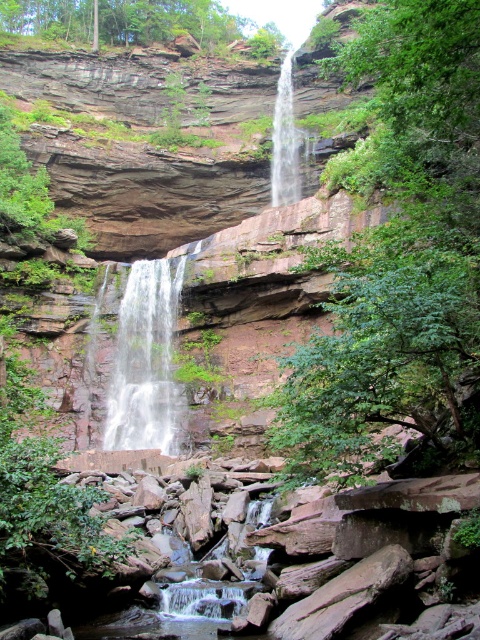
You are a hiker standing at the base of the cliff. You spot two points marked on the cliff face. The first point is at coordinates point (474, 403) and the second is at point (189, 627). Which point is closer to you?

Point (189, 627) is closer to you because it is in front of point (474, 403).

You are standing at the base of the waterfall and want to take a photo of both the green leafy tree at center and the white frothy water at center. Which object should you position to the left side of your camera frame to include both in the shot?

You should position the white frothy water at center to the left side of your camera frame because the green leafy tree at center is to the right of it, ensuring both are captured in the shot.

You are a hiker trying to cross the smooth rock creek at lower center. There is a green leafy tree at center nearby. Can you use the tree to help you cross the creek safely?

The green leafy tree at center is much taller than the smooth rock creek at lower center, so you can use its branches to steady yourself while crossing the creek safely.